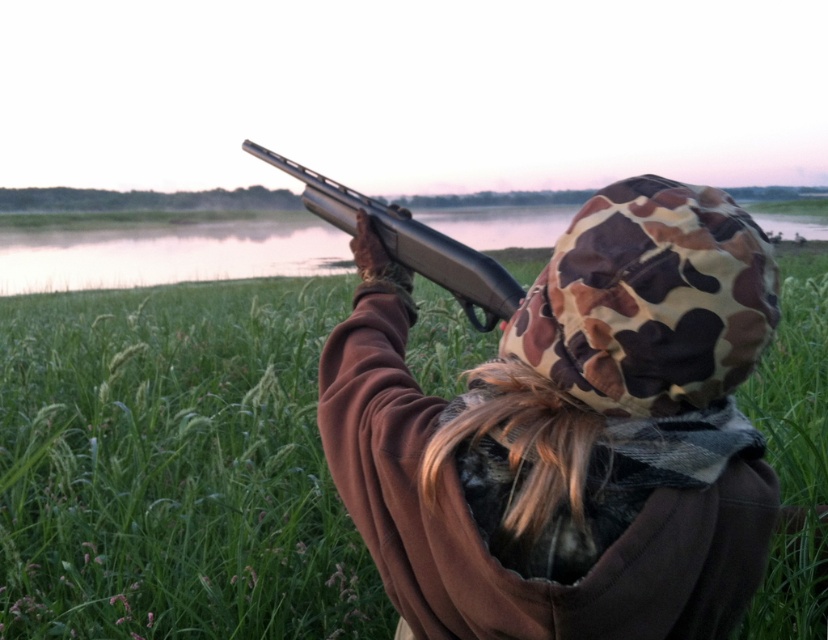
Question: Can you confirm if brown matte jacket at upper center is positioned below matte black shotgun at upper center?

Choices:
 (A) yes
 (B) no

Answer: (A)

Question: Does brown matte jacket at upper center have a larger size compared to matte black shotgun at upper center?

Choices:
 (A) yes
 (B) no

Answer: (A)

Question: Is brown matte jacket at upper center in front of matte black shotgun at upper center?

Choices:
 (A) no
 (B) yes

Answer: (B)

Question: Among these objects, which one is nearest to the camera?

Choices:
 (A) matte black shotgun at upper center
 (B) brown matte jacket at upper center

Answer: (B)